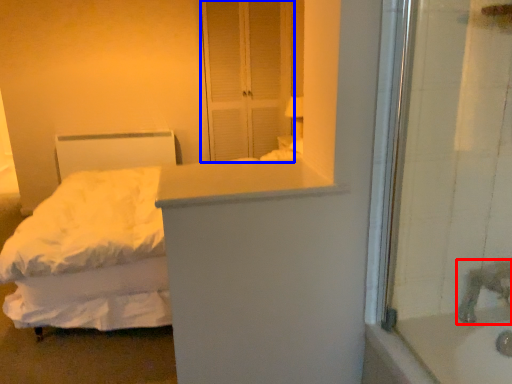
Question: Which point is further to the camera, faucet (highlighted by a red box) or screen door (highlighted by a blue box)?

Choices:
 (A) faucet
 (B) screen door

Answer: (B)